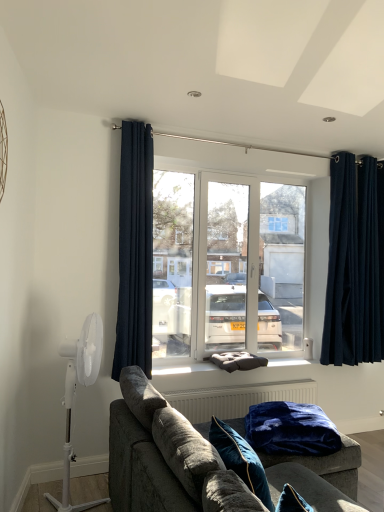
Describe the element at coordinates (186, 369) in the screenshot. I see `dark fabric cushion at center` at that location.

Find the location of a particular element. dark fabric cushion at center is located at coordinates (186, 369).

Describe the element at coordinates (142, 468) in the screenshot. The width and height of the screenshot is (384, 512). I see `velvet gray couch at center` at that location.

The height and width of the screenshot is (512, 384). Describe the element at coordinates (73, 393) in the screenshot. I see `white plastic mechanical fan at left` at that location.

Identify the location of white plastic mechanical fan at left. The width and height of the screenshot is (384, 512). (73, 393).

The image size is (384, 512). I want to click on velvet blue pillow at lower center, placed as the 2th pillow when sorted from back to front, so click(240, 459).

Measure the distance between dark gray plush pillow at center, arranged as the second pillow when viewed from the front, and camera.

They are 3.47 meters apart.

Find the location of a particular element. Image resolution: width=384 pixels, height=512 pixels. white glossy door at center is located at coordinates (245, 269).

Measure the distance between white glossy door at center and camera.

The depth of white glossy door at center is 3.35 meters.

The height and width of the screenshot is (512, 384). In order to click on dark fabric cushion at center in this screenshot , I will do `click(186, 369)`.

Looking at this image, can you confirm if velvet blue blanket at lower center is bigger than dark blue textured curtain at center, acting as the 2th curtain starting from the right?

No.

I want to click on blanket on the right of dark blue textured curtain at center, which appears as the 2th curtain when viewed from the back, so click(x=291, y=429).

Considering the relative positions of velvet blue blanket at lower center and dark blue textured curtain at center, which appears as the 2th curtain when viewed from the back, in the image provided, is velvet blue blanket at lower center to the right of dark blue textured curtain at center, which appears as the 2th curtain when viewed from the back, from the viewer's perspective?

Indeed, velvet blue blanket at lower center is positioned on the right side of dark blue textured curtain at center, which appears as the 2th curtain when viewed from the back.

Between velvet blue blanket at lower center and dark blue textured curtain at center, which ranks as the first curtain in left-to-right order, which one has smaller width?

dark blue textured curtain at center, which ranks as the first curtain in left-to-right order.

Considering the positions of objects velvet blue blanket at lower center and dark gray plush pillow at center, acting as the 1th pillow starting from the back, in the image provided, who is more to the right, velvet blue blanket at lower center or dark gray plush pillow at center, acting as the 1th pillow starting from the back,?

velvet blue blanket at lower center.

From a real-world perspective, who is located lower, velvet blue blanket at lower center or dark gray plush pillow at center, arranged as the second pillow when viewed from the front?

velvet blue blanket at lower center.

Based on the photo, from the image's perspective, is velvet blue blanket at lower center positioned above or below dark gray plush pillow at center, acting as the 1th pillow starting from the back?

velvet blue blanket at lower center is situated lower than dark gray plush pillow at center, acting as the 1th pillow starting from the back, in the image.

Is velvet blue blanket at lower center facing away from dark gray plush pillow at center, arranged as the second pillow when viewed from the front?

No, velvet blue blanket at lower center's orientation is not away from dark gray plush pillow at center, arranged as the second pillow when viewed from the front.

Considering the relative sizes of velvet blue pillow at lower center, placed as the 2th pillow when sorted from back to front, and navy blue velvet curtains at right, arranged as the first curtain when viewed from the right, in the image provided, is velvet blue pillow at lower center, placed as the 2th pillow when sorted from back to front, taller than navy blue velvet curtains at right, arranged as the first curtain when viewed from the right,?

In fact, velvet blue pillow at lower center, placed as the 2th pillow when sorted from back to front, may be shorter than navy blue velvet curtains at right, arranged as the first curtain when viewed from the right.

Which is less distant, (260, 493) or (353, 265)?

Clearly, point (260, 493) is closer to the camera than point (353, 265).

How many degrees apart are the facing directions of velvet blue pillow at lower center, placed as the 2th pillow when sorted from back to front, and navy blue velvet curtains at right, arranged as the second curtain when viewed from the left?

The facing directions of velvet blue pillow at lower center, placed as the 2th pillow when sorted from back to front, and navy blue velvet curtains at right, arranged as the second curtain when viewed from the left, are 81 degrees apart.

Looking at this image, which of these two, velvet blue pillow at lower center, placed as the 2th pillow when sorted from back to front, or navy blue velvet curtains at right, which ranks as the first curtain in back-to-front order, is wider?

velvet blue pillow at lower center, placed as the 2th pillow when sorted from back to front.

From the image's perspective, is dark fabric cushion at center above white plastic mechanical fan at left?

Actually, dark fabric cushion at center appears below white plastic mechanical fan at left in the image.

Is dark fabric cushion at center spatially inside white plastic mechanical fan at left, or outside of it?

dark fabric cushion at center is not inside white plastic mechanical fan at left, it's outside.

Would you say dark fabric cushion at center is a long distance from white plastic mechanical fan at left?

No, dark fabric cushion at center is not far away from white plastic mechanical fan at left.

Could you tell me if dark fabric cushion at center is turned towards white plastic mechanical fan at left?

No.

From a real-world perspective, which is physically above, white glossy door at center or velvet blue blanket at lower center?

white glossy door at center, from a real-world perspective.

Based on the photo, which object is wider, white glossy door at center or velvet blue blanket at lower center?

velvet blue blanket at lower center.

Would you consider white glossy door at center to be distant from velvet blue blanket at lower center?

white glossy door at center is positioned a significant distance from velvet blue blanket at lower center.

Considering the relative positions of velvet gray couch at center and white plastic mechanical fan at left in the image provided, is velvet gray couch at center to the right of white plastic mechanical fan at left from the viewer's perspective?

Indeed, velvet gray couch at center is positioned on the right side of white plastic mechanical fan at left.

Who is bigger, velvet gray couch at center or white plastic mechanical fan at left?

With larger size is velvet gray couch at center.

Who is shorter, velvet gray couch at center or white plastic mechanical fan at left?

velvet gray couch at center is shorter.

From the image's perspective, is velvet gray couch at center below white plastic mechanical fan at left?

Yes, from the image's perspective, velvet gray couch at center is beneath white plastic mechanical fan at left.

This screenshot has height=512, width=384. Identify the location of curtain on the right side of dark blue textured curtain at center, acting as the 2th curtain starting from the right. (355, 263).

Is dark blue textured curtain at center, which appears as the first curtain when viewed from the front, in contact with navy blue velvet curtains at right, which ranks as the first curtain in back-to-front order?

No, dark blue textured curtain at center, which appears as the first curtain when viewed from the front, is not next to navy blue velvet curtains at right, which ranks as the first curtain in back-to-front order.

Does dark blue textured curtain at center, which ranks as the first curtain in left-to-right order, have a lesser height compared to navy blue velvet curtains at right, arranged as the first curtain when viewed from the right?

No, dark blue textured curtain at center, which ranks as the first curtain in left-to-right order, is not shorter than navy blue velvet curtains at right, arranged as the first curtain when viewed from the right.

Measure the distance between dark blue textured curtain at center, which ranks as the first curtain in left-to-right order, and navy blue velvet curtains at right, arranged as the first curtain when viewed from the right.

dark blue textured curtain at center, which ranks as the first curtain in left-to-right order, is 6.00 feet from navy blue velvet curtains at right, arranged as the first curtain when viewed from the right.

Find the location of a particular element. This screenshot has height=512, width=384. curtain that is the 2nd object located above the velvet blue blanket at lower center (from the image's perspective) is located at coordinates (135, 250).

The width and height of the screenshot is (384, 512). Find the location of `pillow located behind the velvet blue blanket at lower center`. pillow located behind the velvet blue blanket at lower center is located at coordinates (237, 361).

Estimate the real-world distances between objects in this image. Which object is closer to white plastic mechanical fan at left, dark fabric cushion at center or white glossy door at center?

dark fabric cushion at center lies closer to white plastic mechanical fan at left than the other object.

Estimate the real-world distances between objects in this image. Which object is closer to white plastic mechanical fan at left, velvet blue blanket at lower center or velvet blue pillow at lower center, arranged as the first pillow when viewed from the front?

velvet blue pillow at lower center, arranged as the first pillow when viewed from the front, lies closer to white plastic mechanical fan at left than the other object.

From the image, which object appears to be nearer to dark fabric cushion at center, dark blue textured curtain at center, which appears as the 2th curtain when viewed from the back, or velvet blue pillow at lower center, placed as the 2th pillow when sorted from back to front?

dark blue textured curtain at center, which appears as the 2th curtain when viewed from the back.

Looking at the image, which one is located further to velvet blue pillow at lower center, placed as the 2th pillow when sorted from back to front, white plastic mechanical fan at left or dark gray plush pillow at center, arranged as the second pillow when viewed from the front?

dark gray plush pillow at center, arranged as the second pillow when viewed from the front, is positioned further to the anchor velvet blue pillow at lower center, placed as the 2th pillow when sorted from back to front.

Considering their positions, is dark blue textured curtain at center, which appears as the 2th curtain when viewed from the back, positioned further to velvet blue blanket at lower center than navy blue velvet curtains at right, which ranks as the first curtain in back-to-front order?

navy blue velvet curtains at right, which ranks as the first curtain in back-to-front order, lies further to velvet blue blanket at lower center than the other object.

From the image, which object appears to be nearer to dark gray plush pillow at center, arranged as the second pillow when viewed from the front, velvet gray couch at center or dark fabric cushion at center?

dark fabric cushion at center is positioned closer to the anchor dark gray plush pillow at center, arranged as the second pillow when viewed from the front.

In the scene shown: From the image, which object appears to be farther from velvet gray couch at center, velvet blue pillow at lower center, placed as the 2th pillow when sorted from back to front, or dark blue textured curtain at center, which appears as the 2th curtain when viewed from the back?

dark blue textured curtain at center, which appears as the 2th curtain when viewed from the back, is positioned further to the anchor velvet gray couch at center.

Looking at the image, which one is located further to dark blue textured curtain at center, which ranks as the first curtain in left-to-right order, velvet blue blanket at lower center or velvet blue pillow at lower center, arranged as the first pillow when viewed from the front?

velvet blue pillow at lower center, arranged as the first pillow when viewed from the front, is further to dark blue textured curtain at center, which ranks as the first curtain in left-to-right order.

I want to click on blanket between velvet blue pillow at lower center, placed as the 2th pillow when sorted from back to front, and dark fabric cushion at center, along the z-axis, so click(291, 429).

Image resolution: width=384 pixels, height=512 pixels. Find the location of `curtain between velvet blue pillow at lower center, placed as the 2th pillow when sorted from back to front, and white glossy door at center from front to back`. curtain between velvet blue pillow at lower center, placed as the 2th pillow when sorted from back to front, and white glossy door at center from front to back is located at coordinates (135, 250).

This screenshot has height=512, width=384. I want to click on curtain between velvet blue pillow at lower center, arranged as the first pillow when viewed from the front, and dark gray plush pillow at center, arranged as the second pillow when viewed from the front, along the z-axis, so click(x=135, y=250).

Locate an element on the screen. The image size is (384, 512). curtain positioned between velvet gray couch at center and dark fabric cushion at center from near to far is located at coordinates (135, 250).